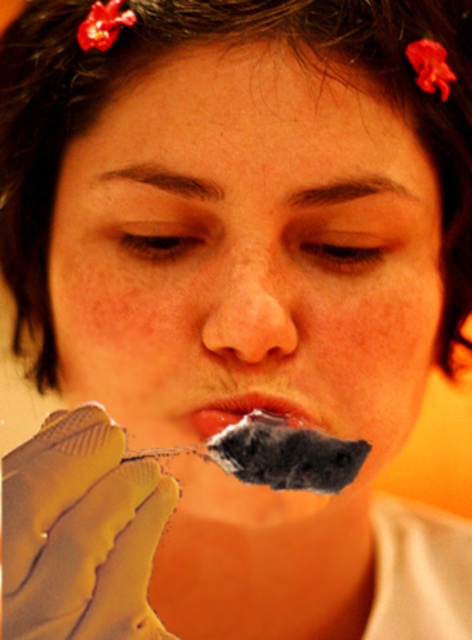
Is smooth flesh nose at center to the left of smooth matte lips at center from the viewer's perspective?

Indeed, smooth flesh nose at center is positioned on the left side of smooth matte lips at center.

Is the position of smooth flesh nose at center less distant than that of smooth matte lips at center?

Yes.

Describe the element at coordinates (250, 308) in the screenshot. The image size is (472, 640). I see `smooth flesh nose at center` at that location.

You are a GUI agent. You are given a task and a screenshot of the screen. Output one action in this format:
    pyautogui.click(x=<x>, y=<y>)
    Task: Click on the smooth flesh nose at center
    Image resolution: width=472 pixels, height=640 pixels.
    Given the screenshot: What is the action you would take?
    pyautogui.click(x=250, y=308)

Between rubber glove at lower left and smooth matte lips at center, which one is positioned lower?

Positioned lower is rubber glove at lower left.

Looking at this image, is rubber glove at lower left above smooth matte lips at center?

Incorrect, rubber glove at lower left is not positioned above smooth matte lips at center.

Locate an element on the screen. This screenshot has height=640, width=472. rubber glove at lower left is located at coordinates (81, 531).

Can you confirm if rubber glove at lower left is taller than smooth flesh nose at center?

Correct, rubber glove at lower left is much taller as smooth flesh nose at center.

Does rubber glove at lower left have a smaller size compared to smooth flesh nose at center?

Incorrect, rubber glove at lower left is not smaller in size than smooth flesh nose at center.

Where is `rubber glove at lower left`? rubber glove at lower left is located at coordinates (81, 531).